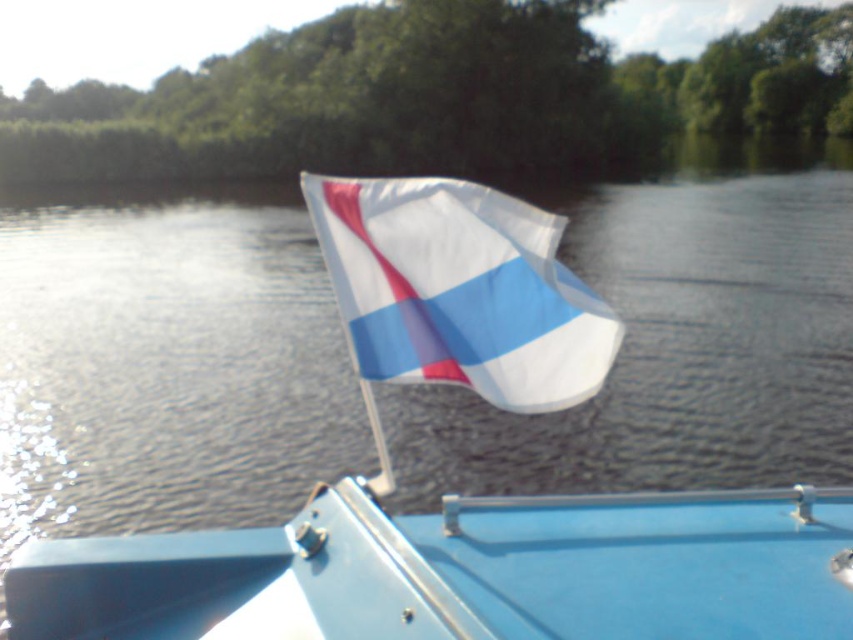
Question: Is blue matte boat at center positioned behind white fabric flag at center?

Choices:
 (A) no
 (B) yes

Answer: (A)

Question: Which point is farther to the camera?

Choices:
 (A) [569, 336]
 (B) [32, 577]

Answer: (B)

Question: Is blue matte boat at center above white fabric flag at center?

Choices:
 (A) no
 (B) yes

Answer: (A)

Question: Where is blue matte boat at center located in relation to white fabric flag at center in the image?

Choices:
 (A) below
 (B) above

Answer: (A)